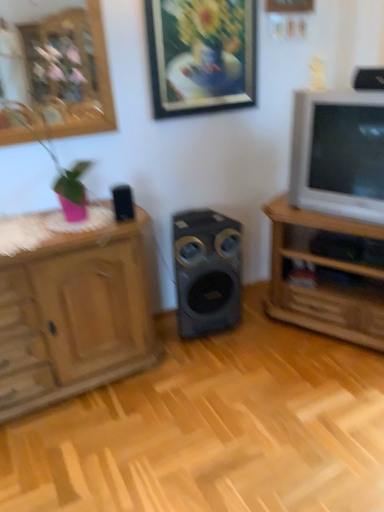
Where is `free point above wooden cabinet at left (from a real-world perspective)`? The height and width of the screenshot is (512, 384). free point above wooden cabinet at left (from a real-world perspective) is located at coordinates (56, 224).